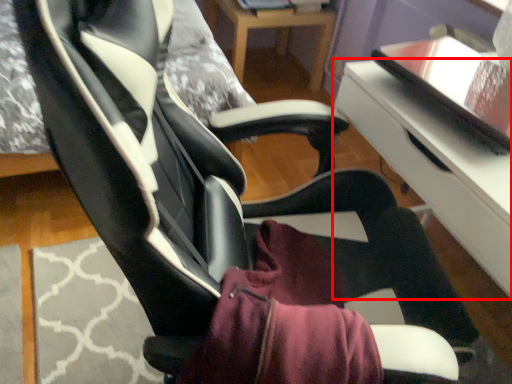
Question: Observing the image, what is the correct spatial positioning of table (annotated by the red box) in reference to table?

Choices:
 (A) right
 (B) left

Answer: (A)